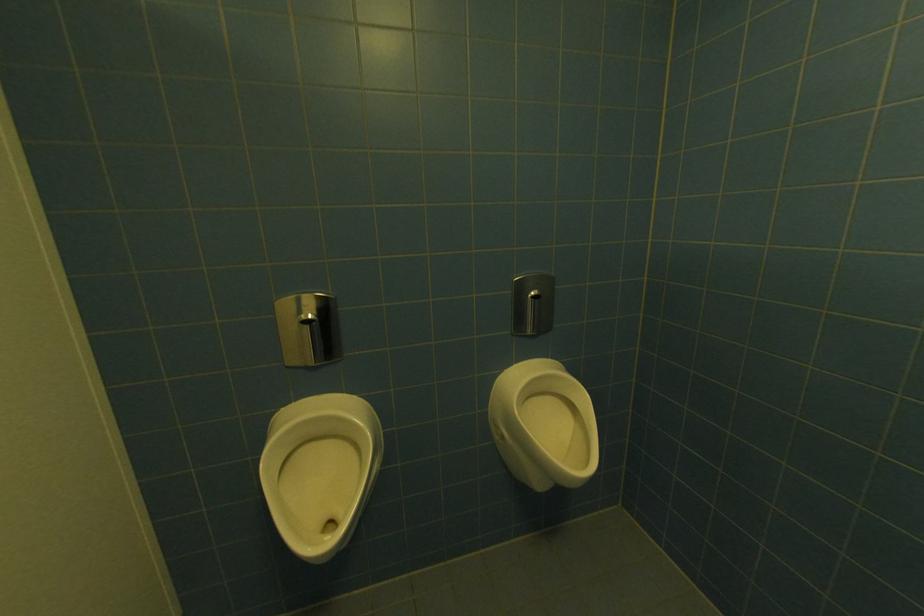
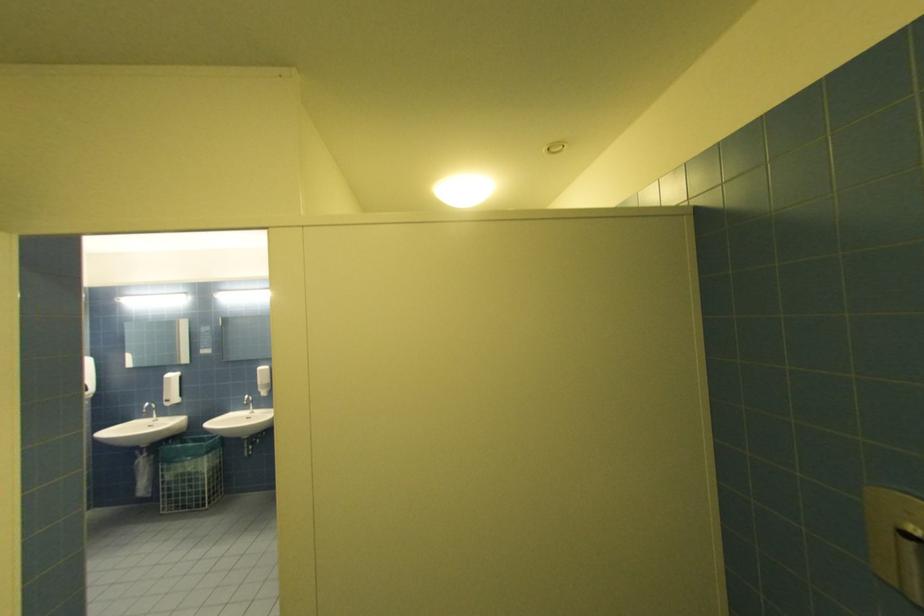
Question: The camera is either moving clockwise (left) or counter-clockwise (right) around the object. The first image is from the beginning of the video and the second image is from the end. Is the camera moving left or right when shooting the video?

Choices:
 (A) Left
 (B) Right

Answer: (B)